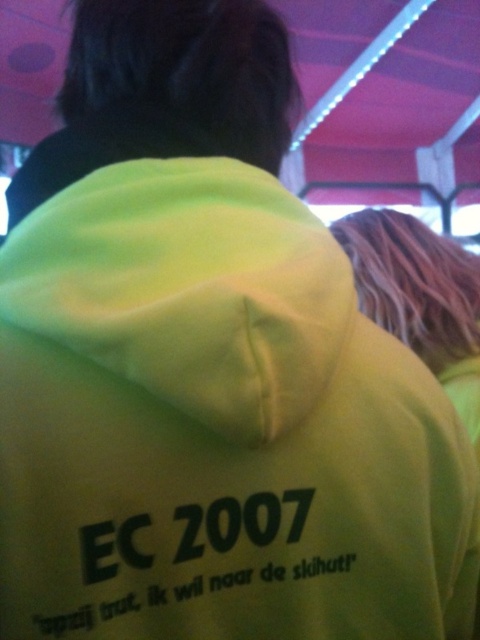
The width and height of the screenshot is (480, 640). Describe the element at coordinates (400, 99) in the screenshot. I see `matte pink canopy at upper center` at that location.

Does matte pink canopy at upper center have a smaller size compared to neon yellow hoodie at upper right?

Incorrect, matte pink canopy at upper center is not smaller in size than neon yellow hoodie at upper right.

Describe the element at coordinates (400, 99) in the screenshot. I see `matte pink canopy at upper center` at that location.

This screenshot has height=640, width=480. What are the coordinates of `matte pink canopy at upper center` in the screenshot? It's located at (400, 99).